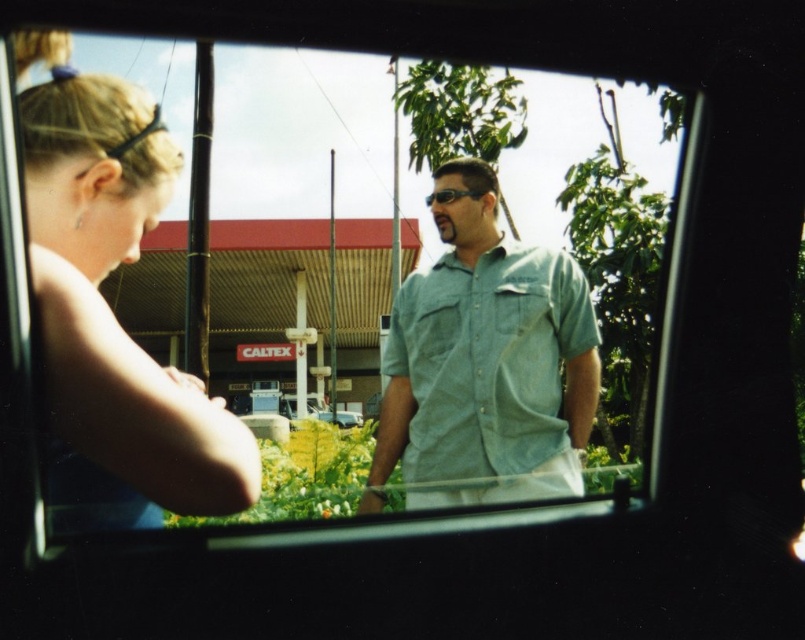
You are sitting in the car and want to hand a water bottle to the person wearing the denim shirt at center through the transparent glass car window at center. Can you reach them without getting out of the car?

The transparent glass car window at center and denim shirt at center are 2.93 meters apart. Since the distance is quite large, you likely cannot reach them without getting out of the car.

You are a passenger in the car and want to see the Caltex gas station sign clearly. Which object, the transparent glass car window at center or the denim shirt at center, allows you to have a wider view of the sign?

The transparent glass car window at center has a greater width than the denim shirt at center, so it provides a wider view of the Caltex gas station sign.

You are sitting in the driver seat of the vehicle and want to check if the two points, point (x=263, y=140) and point (x=436, y=198), are visible in your rearview mirror. Based on their positions, which point is closer to you?

Point (x=263, y=140) is further to the viewer than point (x=436, y=198). Therefore, point (x=436, y=198) is closer to you and would be more visible in the rearview mirror.